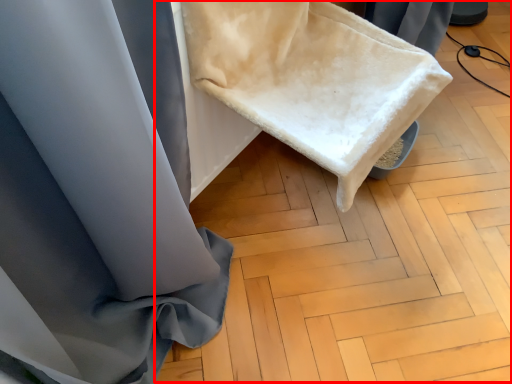
Question: From the image, what is the correct spatial relationship of wood (annotated by the red box) in relation to wide?

Choices:
 (A) right
 (B) left

Answer: (A)